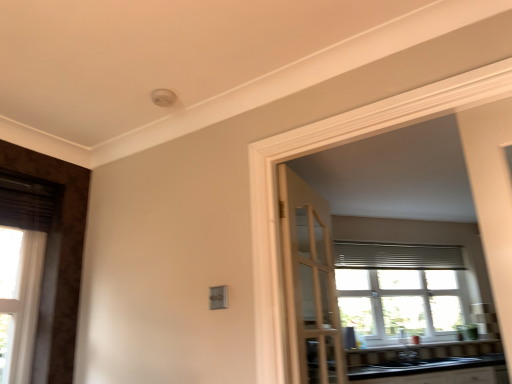
Question: Is black glossy sink at lower center, which is the 2th sink in left-to-right order, touching white wood door at left, which appears as the 2th door when viewed from the right?

Choices:
 (A) yes
 (B) no

Answer: (B)

Question: Considering the relative sizes of black glossy sink at lower center, which is the 2th sink in left-to-right order, and white wood door at left, which appears as the first door when viewed from the left, in the image provided, is black glossy sink at lower center, which is the 2th sink in left-to-right order, shorter than white wood door at left, which appears as the first door when viewed from the left,?

Choices:
 (A) yes
 (B) no

Answer: (A)

Question: Does black glossy sink at lower center, the first sink positioned from the right, have a larger size compared to white wood door at left, which appears as the 2th door when viewed from the right?

Choices:
 (A) yes
 (B) no

Answer: (B)

Question: Could white wood door at left, which appears as the 2th door when viewed from the right, be considered to be inside black glossy sink at lower center, the first sink positioned from the right?

Choices:
 (A) yes
 (B) no

Answer: (B)

Question: Is black glossy sink at lower center, the first sink positioned from the right, closer to the viewer compared to white wood door at left, which appears as the first door when viewed from the left?

Choices:
 (A) yes
 (B) no

Answer: (B)

Question: Does point (397, 350) appear closer or farther from the camera than point (461, 254)?

Choices:
 (A) closer
 (B) farther

Answer: (A)

Question: In terms of size, does white glossy window sill at lower center appear bigger or smaller than silver metallic blinds at upper center?

Choices:
 (A) big
 (B) small

Answer: (B)

Question: Considering the positions of white glossy window sill at lower center and silver metallic blinds at upper center in the image, is white glossy window sill at lower center taller or shorter than silver metallic blinds at upper center?

Choices:
 (A) tall
 (B) short

Answer: (B)

Question: From the image's perspective, relative to silver metallic blinds at upper center, is white glossy window sill at lower center above or below?

Choices:
 (A) above
 (B) below

Answer: (B)

Question: From a real-world perspective, is light wood door at center, acting as the 1th door starting from the right, physically located above or below white glossy window sill at lower center?

Choices:
 (A) above
 (B) below

Answer: (A)

Question: In the image, is light wood door at center, acting as the 1th door starting from the right, positioned in front of or behind white glossy window sill at lower center?

Choices:
 (A) behind
 (B) front

Answer: (B)

Question: Looking at the image, does light wood door at center, positioned as the second door in left-to-right order, seem bigger or smaller compared to white glossy window sill at lower center?

Choices:
 (A) small
 (B) big

Answer: (B)

Question: Which is correct: light wood door at center, acting as the 1th door starting from the right, is inside white glossy window sill at lower center, or outside of it?

Choices:
 (A) outside
 (B) inside

Answer: (A)

Question: Is white glass window at center taller or shorter than light wood door at center, positioned as the second door in left-to-right order?

Choices:
 (A) tall
 (B) short

Answer: (B)

Question: From a real-world perspective, relative to light wood door at center, acting as the 1th door starting from the right, is white glass window at center vertically above or below?

Choices:
 (A) above
 (B) below

Answer: (B)